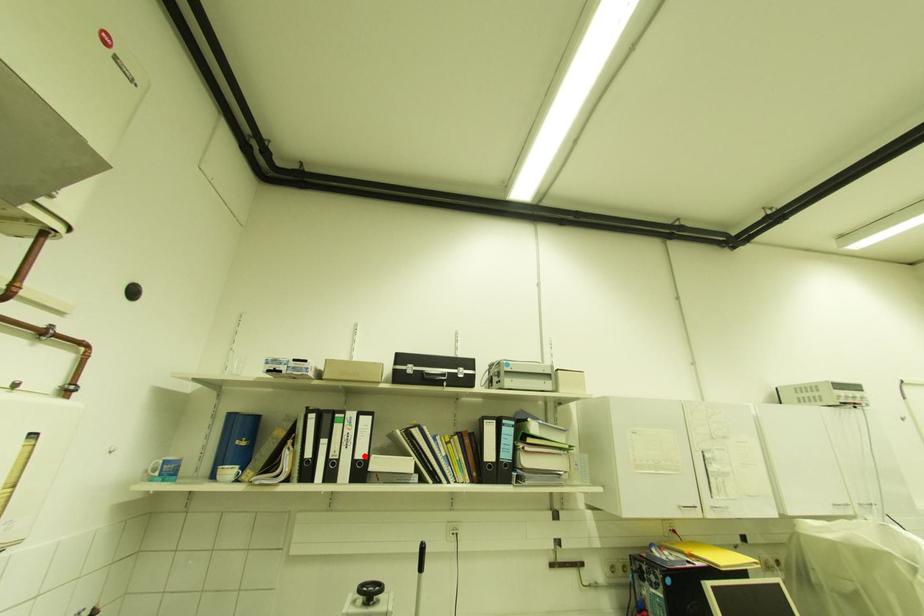
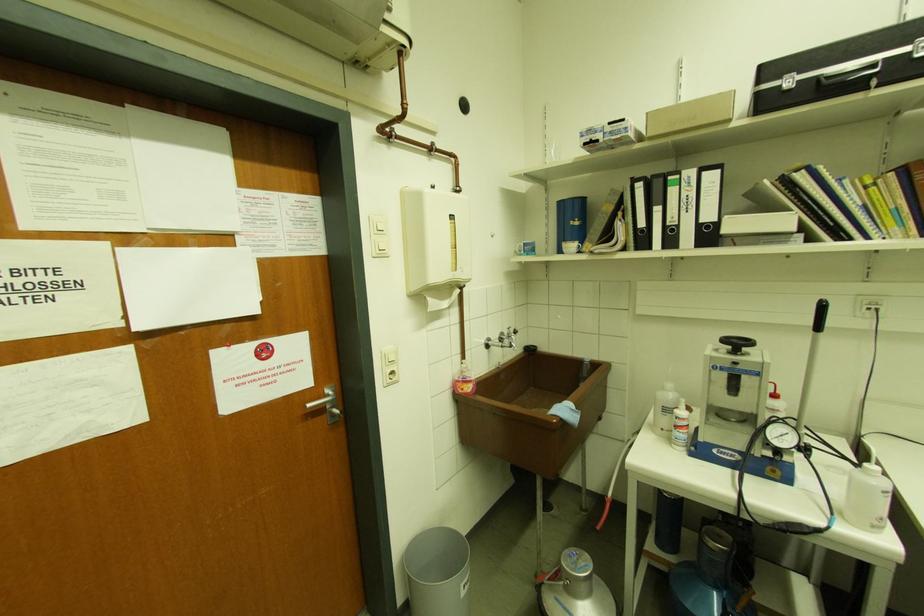
The point at the highlighted location is marked in the first image. Where is the corresponding point in the second image?

(712, 217)